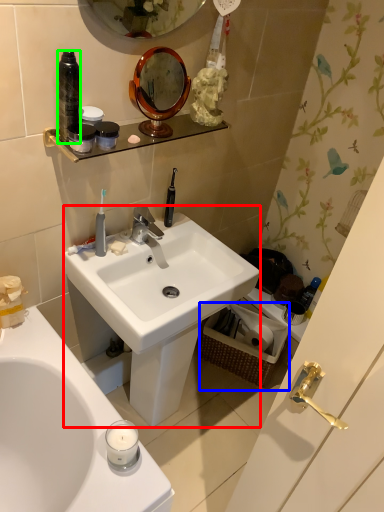
Question: Which is nearer to the sink (highlighted by a red box)? picnic basket (highlighted by a blue box) or bottle (highlighted by a green box).

Choices:
 (A) picnic basket
 (B) bottle

Answer: (A)